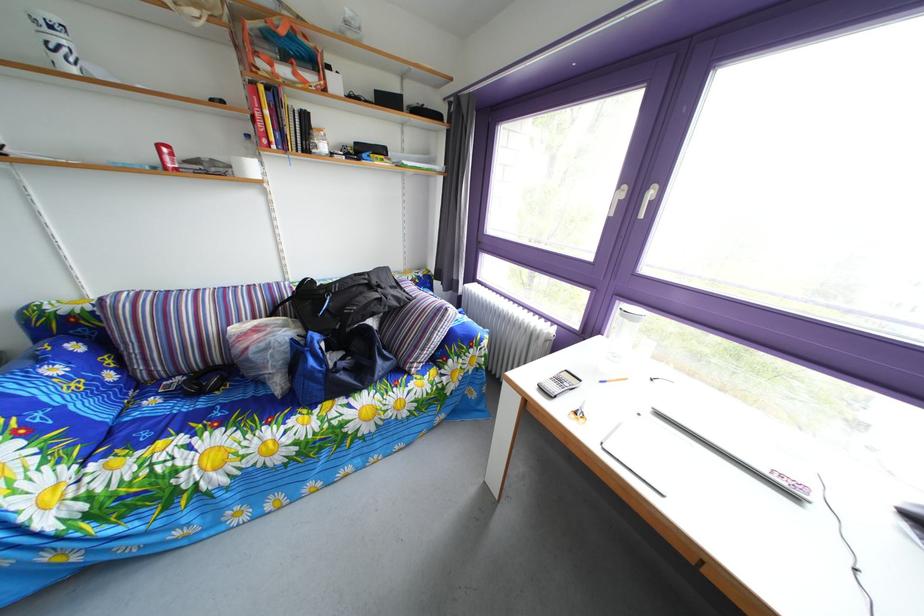
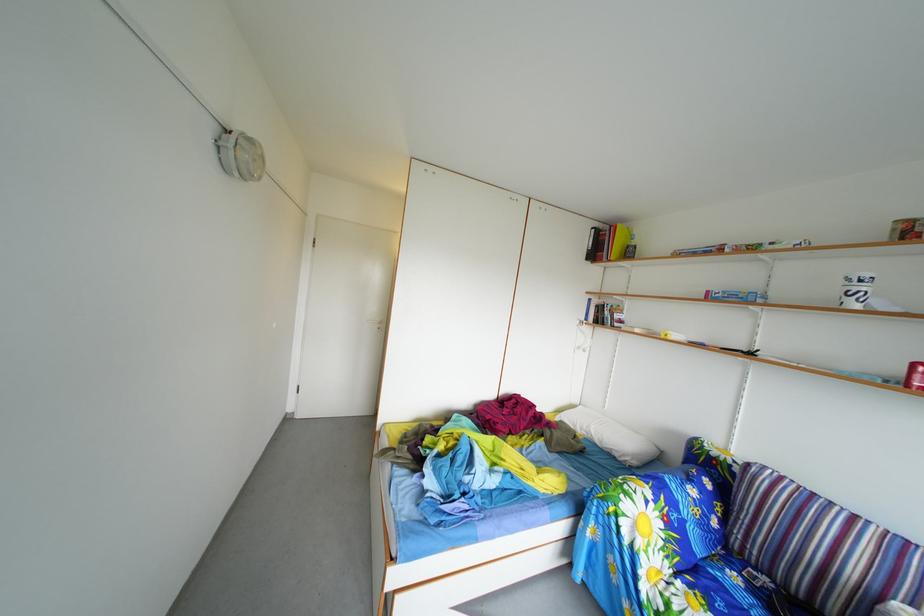
Question: The camera is either moving clockwise (left) or counter-clockwise (right) around the object. The first image is from the beginning of the video and the second image is from the end. Is the camera moving left or right when shooting the video?

Choices:
 (A) Left
 (B) Right

Answer: (B)